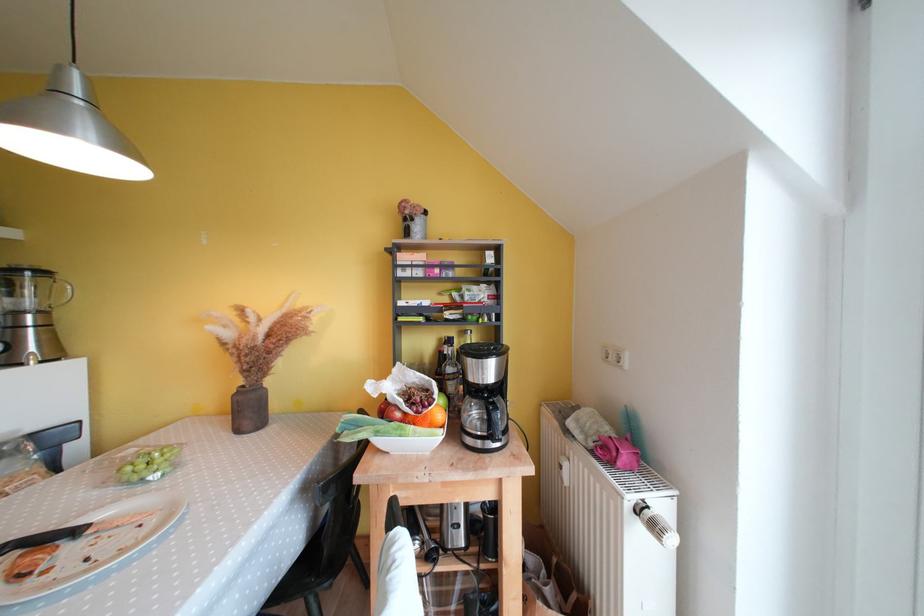
Image resolution: width=924 pixels, height=616 pixels. Describe the element at coordinates (30, 314) in the screenshot. I see `a glass blender container` at that location.